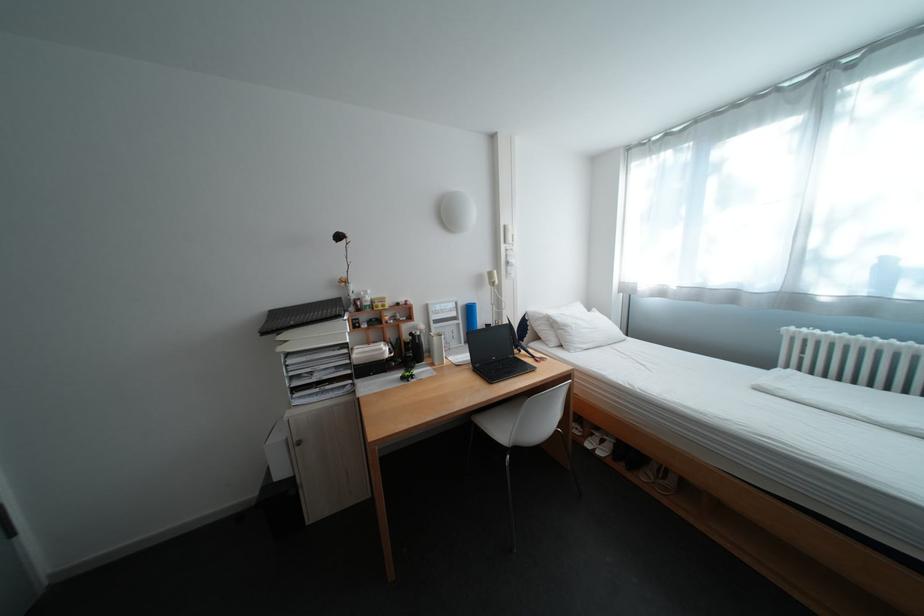
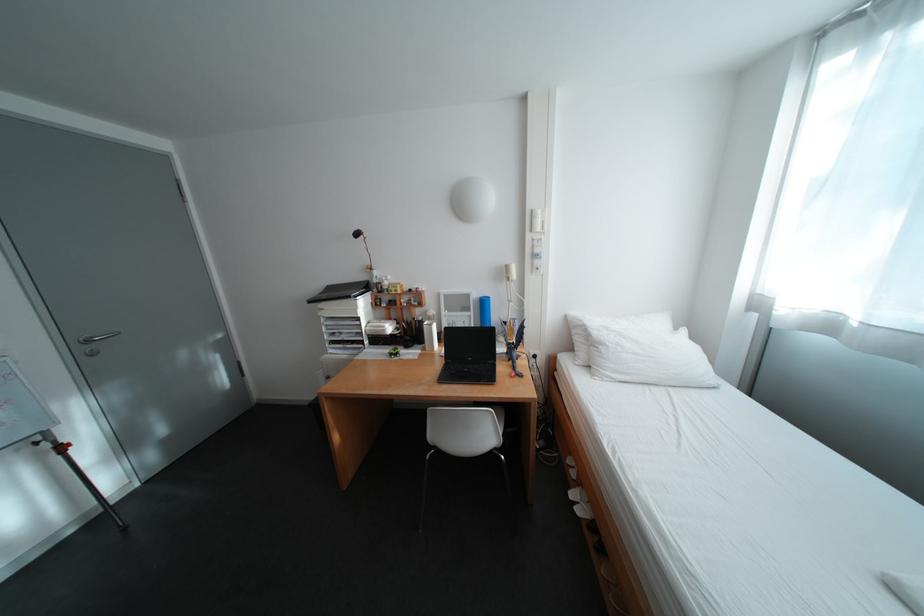
Locate, in the second image, the point that corresponds to pixel 327 376 in the first image.

(355, 336)